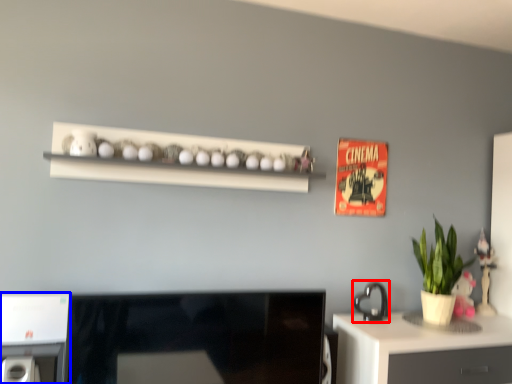
Question: Which object is closer to the camera taking this photo, appliance (highlighted by a red box) or appliance (highlighted by a blue box)?

Choices:
 (A) appliance
 (B) appliance

Answer: (B)